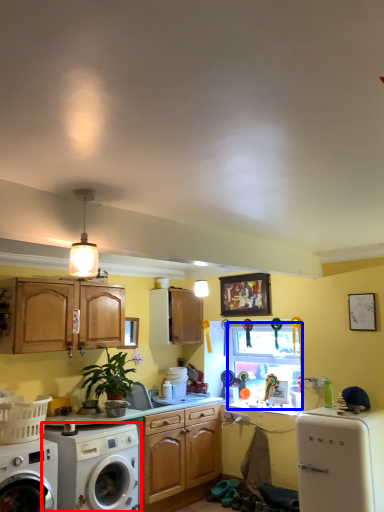
Question: Which object appears farthest to the camera in this image, washing machine (highlighted by a red box) or window screen (highlighted by a blue box)?

Choices:
 (A) washing machine
 (B) window screen

Answer: (B)